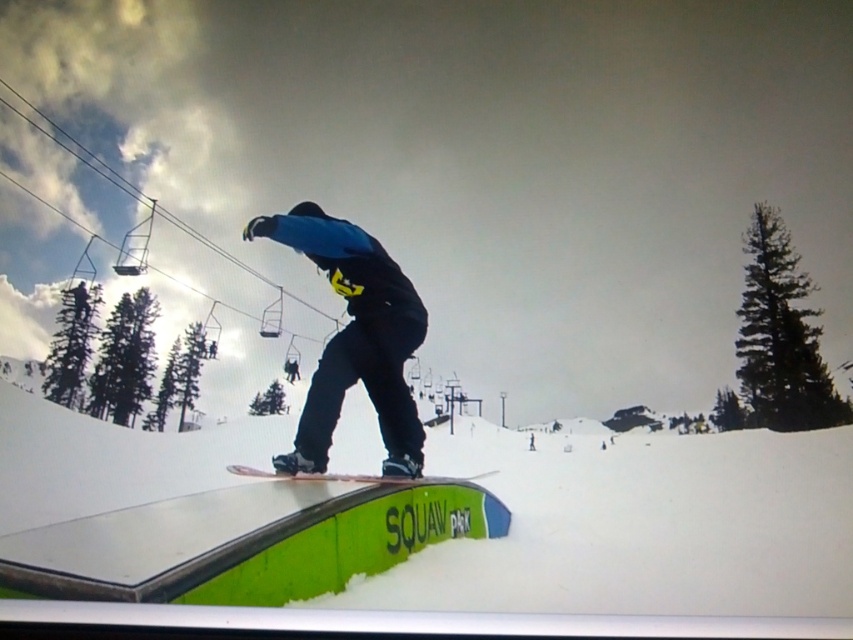
Question: Which object appears closest to the camera in this image?

Choices:
 (A) white matte snowboard at center
 (B) white matte snow at center
 (C) matte black snowboarder at center

Answer: (B)

Question: Which of the following is the closest to the observer?

Choices:
 (A) (732, 600)
 (B) (387, 481)

Answer: (A)

Question: Does matte black snowboarder at center appear under white matte snowboard at center?

Choices:
 (A) yes
 (B) no

Answer: (B)

Question: Can you confirm if matte black snowboarder at center is positioned above white matte snowboard at center?

Choices:
 (A) yes
 (B) no

Answer: (A)

Question: Is white matte snow at center below white matte snowboard at center?

Choices:
 (A) no
 (B) yes

Answer: (B)

Question: Which object is closer to the camera taking this photo?

Choices:
 (A) white matte snowboard at center
 (B) matte black snowboarder at center
 (C) white matte snow at center

Answer: (C)